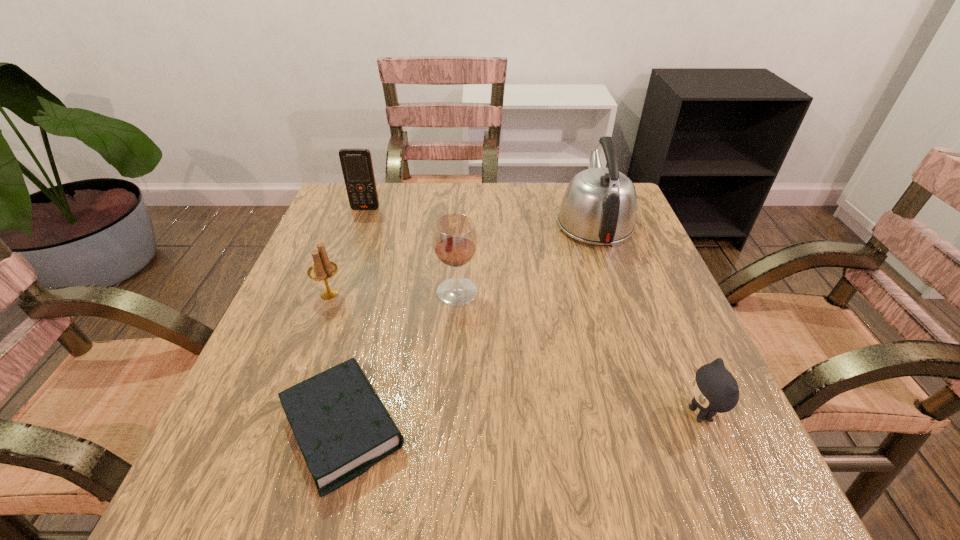
Locate an element on the screen. Image resolution: width=960 pixels, height=540 pixels. Bible positioned at the left edge is located at coordinates (342, 427).

The image size is (960, 540). In order to click on kettle that is at the right edge in this screenshot , I will do `click(599, 206)`.

Locate an element on the screen. This screenshot has height=540, width=960. kitten situated at the right edge is located at coordinates (715, 390).

Where is `object that is at the far left corner`? object that is at the far left corner is located at coordinates (356, 163).

Find the location of a particular element. object that is positioned at the near left corner is located at coordinates (342, 427).

Image resolution: width=960 pixels, height=540 pixels. What are the coordinates of `object at the far right corner` in the screenshot? It's located at tap(599, 206).

Locate an element on the screen. vacant space at the far edge is located at coordinates (494, 211).

In the image, there is a desktop. Where is `free region at the near edge`? The width and height of the screenshot is (960, 540). free region at the near edge is located at coordinates (318, 495).

Identify the location of vacant space at the left edge of the desktop. The image size is (960, 540). [x=365, y=284].

The width and height of the screenshot is (960, 540). What are the coordinates of `vacant area at the right edge` in the screenshot? It's located at (662, 288).